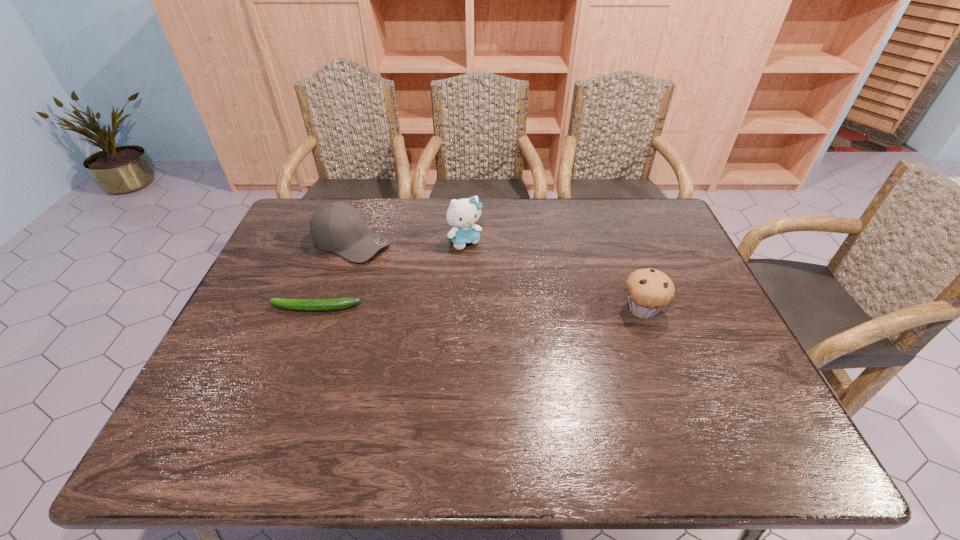
This screenshot has height=540, width=960. In order to click on empty space between the shortest object and the rightmost object in this screenshot , I will do `click(479, 308)`.

I want to click on free point between the baseball cap and the zucchini, so click(333, 275).

At what (x,y) coordinates should I click in order to perform the action: click on vacant region between the baseball cap and the zucchini. Please return your answer as a coordinate pair (x, y). Image resolution: width=960 pixels, height=540 pixels. Looking at the image, I should click on (333, 275).

Identify the location of free space that is in between the kitten and the muffin. The height and width of the screenshot is (540, 960). (554, 275).

Locate an element on the screen. free space between the shortest object and the tallest object is located at coordinates (391, 274).

Identify which object is the closest to the zucchini. Please provide its 2D coordinates. Your answer should be formatted as a tuple, i.e. [(x, y)], where the tuple contains the x and y coordinates of a point satisfying the conditions above.

[(338, 227)]

Identify which object is located as the second nearest to the baseball cap. Please provide its 2D coordinates. Your answer should be formatted as a tuple, i.e. [(x, y)], where the tuple contains the x and y coordinates of a point satisfying the conditions above.

[(461, 214)]

Identify the location of free region that satisfies the following two spatial constraints: 1. on the front side of the second object from right to left; 2. on the left side of the muffin. (463, 309).

This screenshot has height=540, width=960. Find the location of `free point that satisfies the following two spatial constraints: 1. on the front side of the baseball cap; 2. on the right side of the rightmost object`. free point that satisfies the following two spatial constraints: 1. on the front side of the baseball cap; 2. on the right side of the rightmost object is located at coordinates (328, 309).